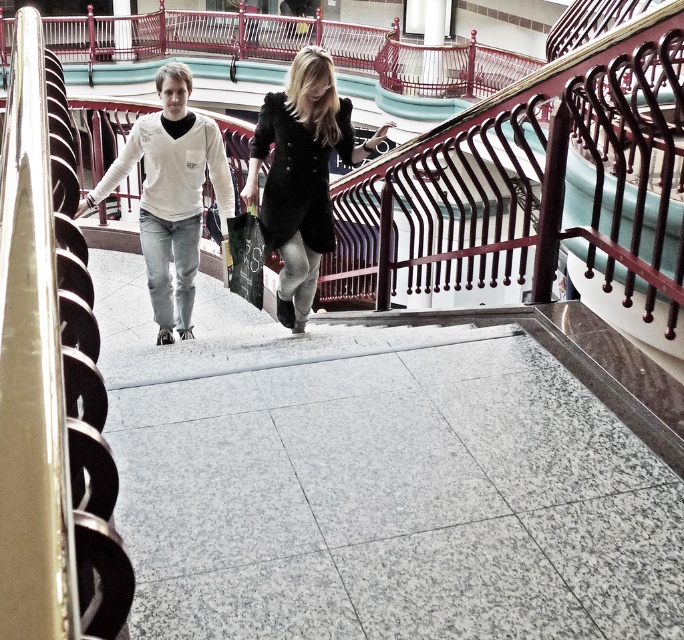
Is white matte sweater at left taller than matte black handbag at upper center?

Correct, white matte sweater at left is much taller as matte black handbag at upper center.

Who is positioned more to the left, white matte sweater at left or matte black handbag at upper center?

Positioned to the left is white matte sweater at left.

Image resolution: width=684 pixels, height=640 pixels. Describe the element at coordinates (171, 195) in the screenshot. I see `white matte sweater at left` at that location.

The width and height of the screenshot is (684, 640). Find the location of `white matte sweater at left`. white matte sweater at left is located at coordinates (171, 195).

Can you confirm if black wool coat at center is thinner than white matte sweater at left?

Yes, black wool coat at center is thinner than white matte sweater at left.

The image size is (684, 640). Identify the location of black wool coat at center. (302, 173).

Is black wool coat at center to the right of matte black handbag at upper center from the viewer's perspective?

Correct, you'll find black wool coat at center to the right of matte black handbag at upper center.

Does point (276, 168) lie in front of point (250, 184)?

That is True.

Between point (274, 177) and point (252, 179), which one is positioned behind?

The point (252, 179) is behind.

This screenshot has width=684, height=640. I want to click on black wool coat at center, so click(302, 173).